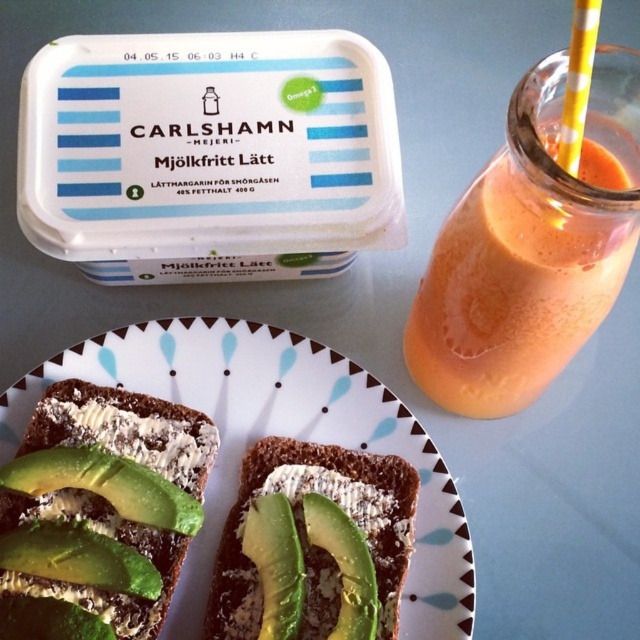
You are setting up a small table for a breakfast. You have a white ceramic plate at center and green avocado toast at center. If you want to place both items on the table, which one should be placed first to ensure they both fit?

The white ceramic plate at center should be placed first since it is larger than the green avocado toast at center, allowing enough space for both items on the table.

You are standing at the point marked by the coordinates point [307,536] and want to reach the glass bottle filled with vibrant orange smoothie or juice to the right of the plate. Can you move straight ahead from your current position to the bottle?

The point [307,536] is where the green avocado toast at lower center is located. Since the glass bottle is to the right of the plate, moving straight ahead from the green avocado toast at lower center would not directly lead to the bottle. You would need to adjust your path to the right to reach it.

You are a food stylist arranging items on a table. You have a white ceramic plate at center and a green avocado toast at center. Based on the scene description, which object is positioned higher up?

The white ceramic plate at center is located above the green avocado toast at center, so it is positioned higher up.